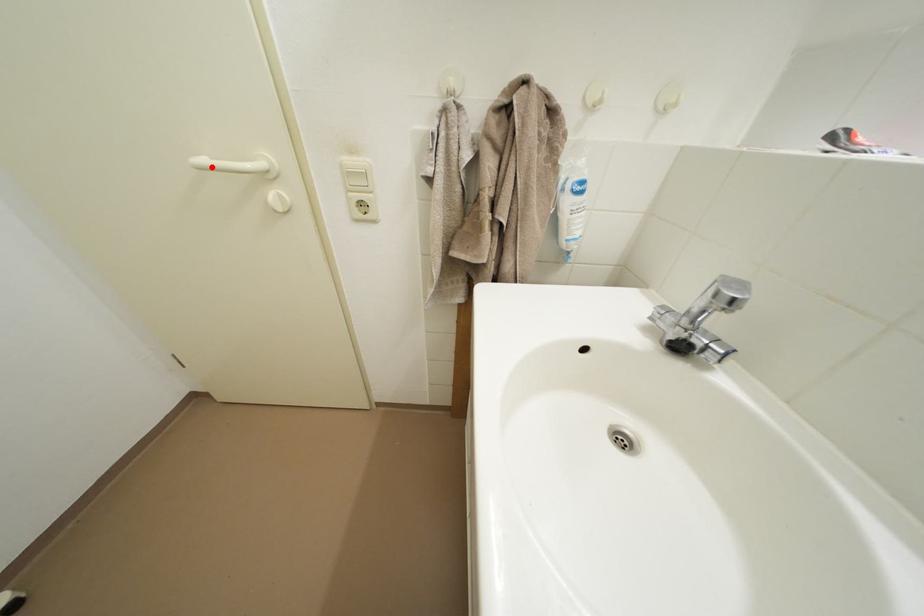
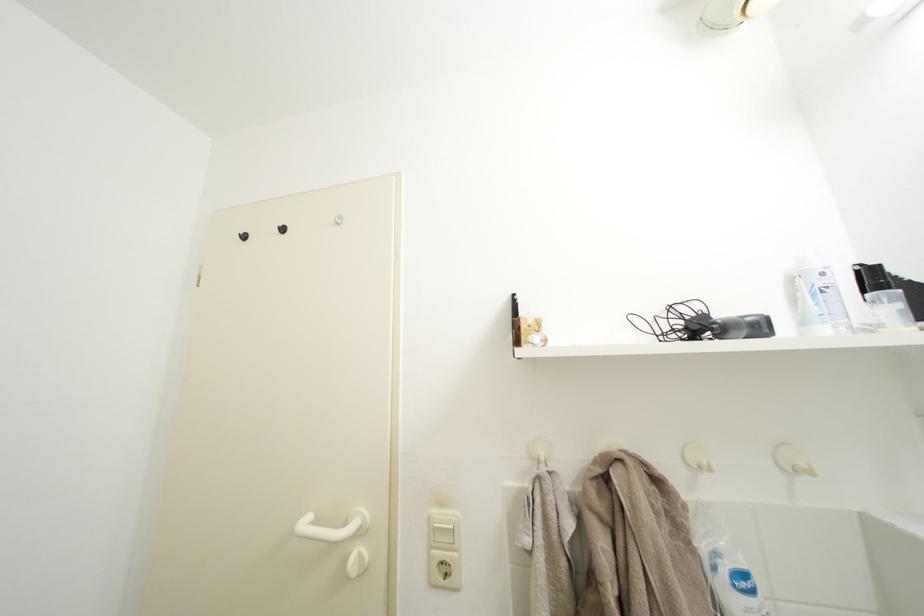
Question: I am providing you with two images of the same scene from different viewpoints. A red point is marked on the first image. Is the red point's position out of view in image 2?

Choices:
 (A) Yes
 (B) No

Answer: (B)